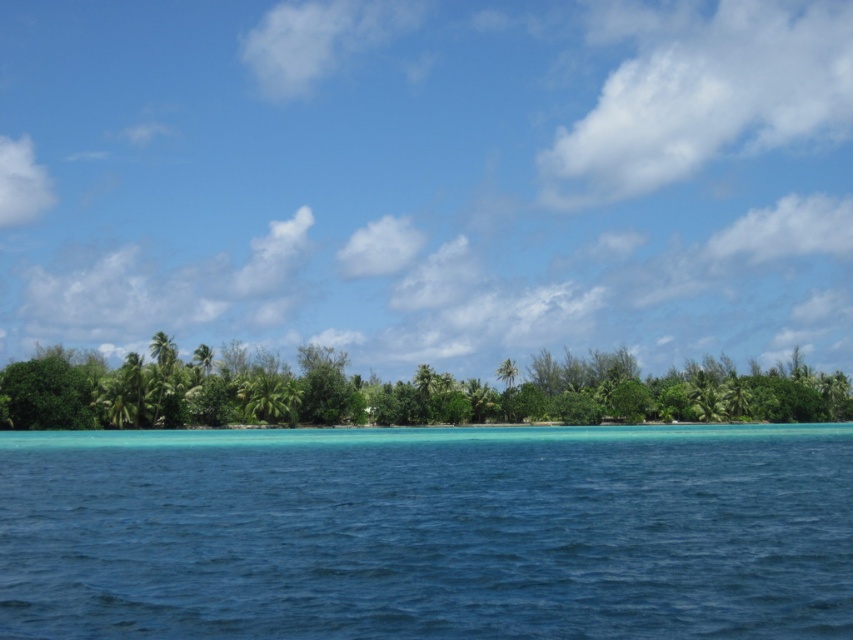
Does green leafy trees at center appear under green leafy palm tree at center?

Correct, green leafy trees at center is located below green leafy palm tree at center.

Consider the image. Who is taller, green leafy trees at center or green leafy palm tree at center?

With more height is green leafy trees at center.

Measure the distance between green leafy trees at center and camera.

green leafy trees at center and camera are 290.54 feet apart from each other.

This screenshot has width=853, height=640. I want to click on green leafy trees at center, so click(401, 390).

Can you confirm if clear blue water at center is positioned to the left of green leafy palm tree at center?

No, clear blue water at center is not to the left of green leafy palm tree at center.

This screenshot has width=853, height=640. Describe the element at coordinates (428, 532) in the screenshot. I see `clear blue water at center` at that location.

Which is behind, point (599, 465) or point (260, 401)?

Point (260, 401)

Locate an element on the screen. clear blue water at center is located at coordinates (x=428, y=532).

This screenshot has height=640, width=853. What do you see at coordinates (428, 532) in the screenshot?
I see `clear blue water at center` at bounding box center [428, 532].

Is point (575, 554) positioned in front of point (166, 404)?

That is True.

Is point (585, 548) farther from viewer compared to point (476, 417)?

No, it is in front of (476, 417).

Find the location of a particular element. clear blue water at center is located at coordinates (428, 532).